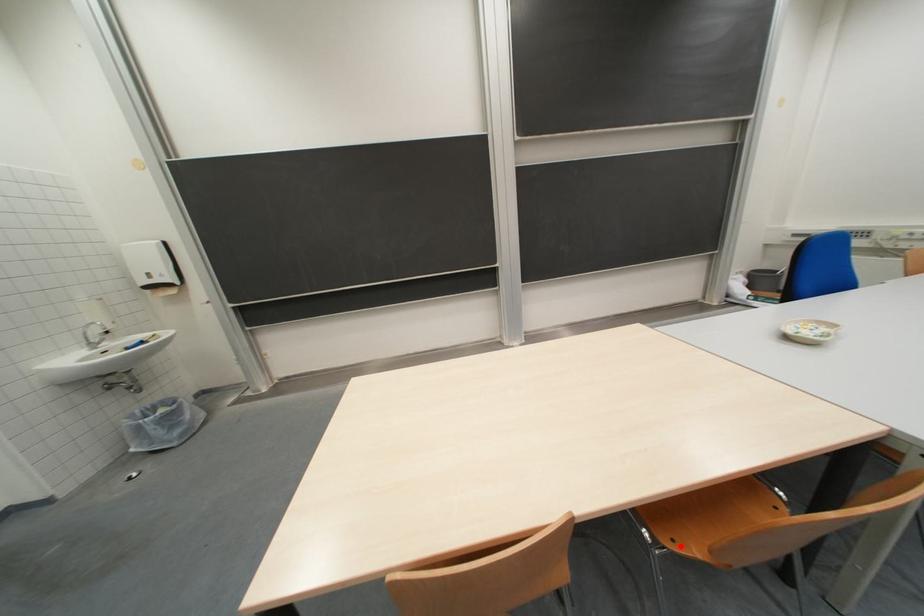
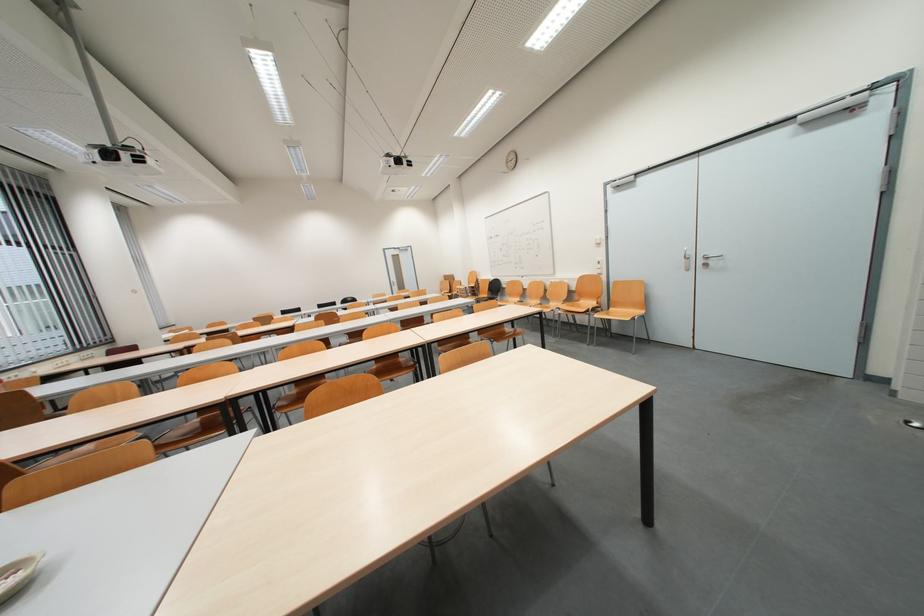
Question: I am providing you with two images of the same scene from different viewpoints. A red point is marked on the first image. Is the red point's position out of view in image 2?

Choices:
 (A) Yes
 (B) No

Answer: (A)